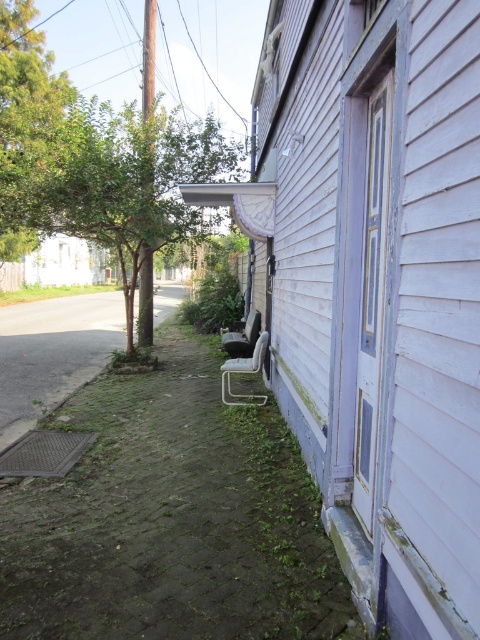
Is green leafy tree at upper left further to camera compared to metallic gray chair at lower center?

No, it is in front of metallic gray chair at lower center.

Does point (51, 150) come closer to viewer compared to point (255, 317)?

Yes.

Find the location of a particular element. This screenshot has height=640, width=480. green leafy tree at upper left is located at coordinates (25, 125).

Is green leafy tree at upper left shorter than metallic silver chair at lower center?

In fact, green leafy tree at upper left may be taller than metallic silver chair at lower center.

What do you see at coordinates (25, 125) in the screenshot?
I see `green leafy tree at upper left` at bounding box center [25, 125].

Locate an element on the screen. The width and height of the screenshot is (480, 640). green leafy tree at upper left is located at coordinates (25, 125).

Is green leafy tree at left above metallic silver chair at lower center?

Yes.

In the scene shown: Which is more to the right, green leafy tree at left or metallic silver chair at lower center?

From the viewer's perspective, metallic silver chair at lower center appears more on the right side.

Who is more forward, (115, 236) or (229, 378)?

Positioned in front is point (229, 378).

Image resolution: width=480 pixels, height=640 pixels. Find the location of `green leafy tree at left`. green leafy tree at left is located at coordinates (127, 180).